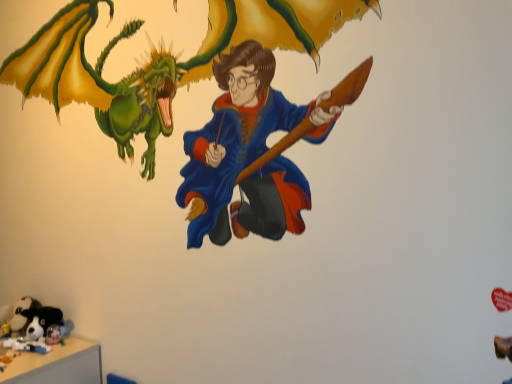
Where is `vacant space underneath soft plush toy at bottom left (from a real-world perspective)`? The width and height of the screenshot is (512, 384). vacant space underneath soft plush toy at bottom left (from a real-world perspective) is located at coordinates (33, 344).